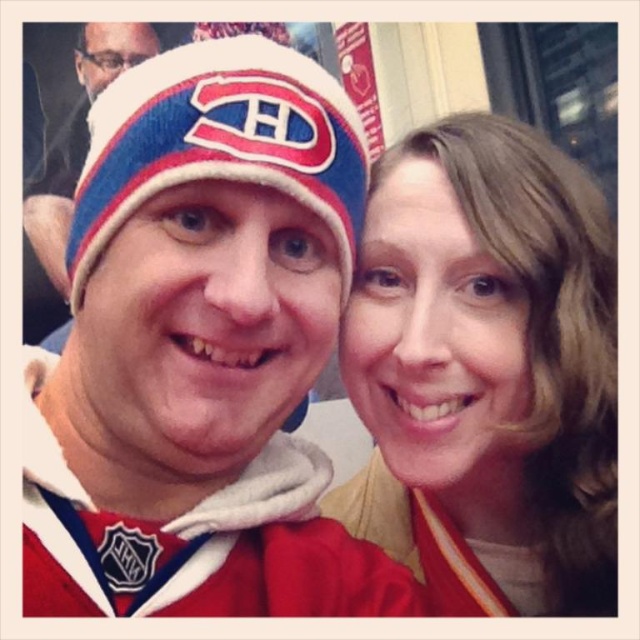
Between point (449, 534) and point (307, 104), which one is positioned in front?

Point (307, 104)

Can you confirm if matte yellow sweater at center is positioned to the right of blue knit beanie at center?

Yes, matte yellow sweater at center is to the right of blue knit beanie at center.

Is point (598, 378) in front of point (100, 113)?

No, (598, 378) is behind (100, 113).

At what (x,y) coordinates should I click in order to perform the action: click on matte yellow sweater at center. Please return your answer as a coordinate pair (x, y). The image size is (640, 640). Looking at the image, I should click on (486, 371).

Who is positioned more to the left, matte yellow sweater at center or blue knit beanie at upper left?

blue knit beanie at upper left is more to the left.

Based on the photo, is matte yellow sweater at center to the right of blue knit beanie at upper left from the viewer's perspective?

Indeed, matte yellow sweater at center is positioned on the right side of blue knit beanie at upper left.

What do you see at coordinates (486, 371) in the screenshot? I see `matte yellow sweater at center` at bounding box center [486, 371].

Locate an element on the screen. The height and width of the screenshot is (640, 640). matte yellow sweater at center is located at coordinates (486, 371).

Which is below, matte fabric hat at upper left or matte yellow sweater at center?

matte yellow sweater at center

Does point (186, 93) lie in front of point (428, 340)?

That is True.

The height and width of the screenshot is (640, 640). I want to click on matte fabric hat at upper left, so click(x=198, y=346).